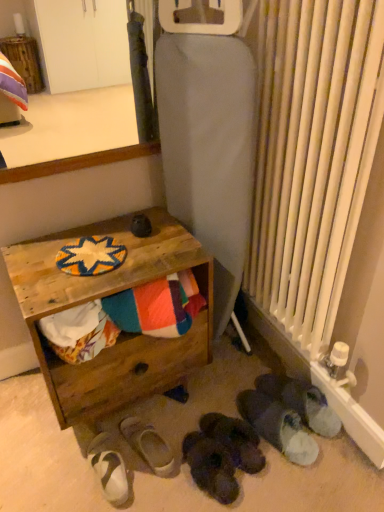
Identify the location of free space to the back side of black suede slippers at lower center, positioned as the 3th footwear in right-to-left order. The height and width of the screenshot is (512, 384). (211, 392).